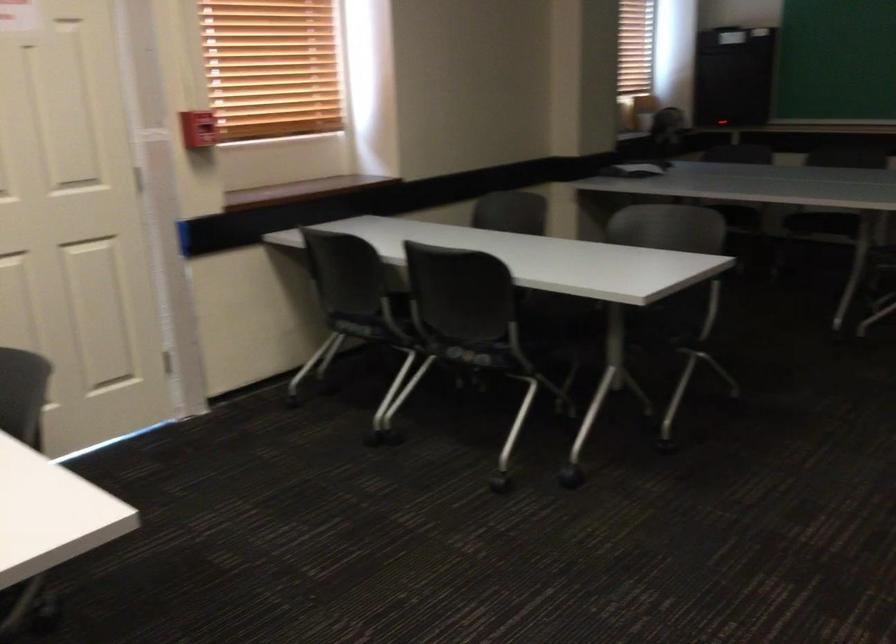
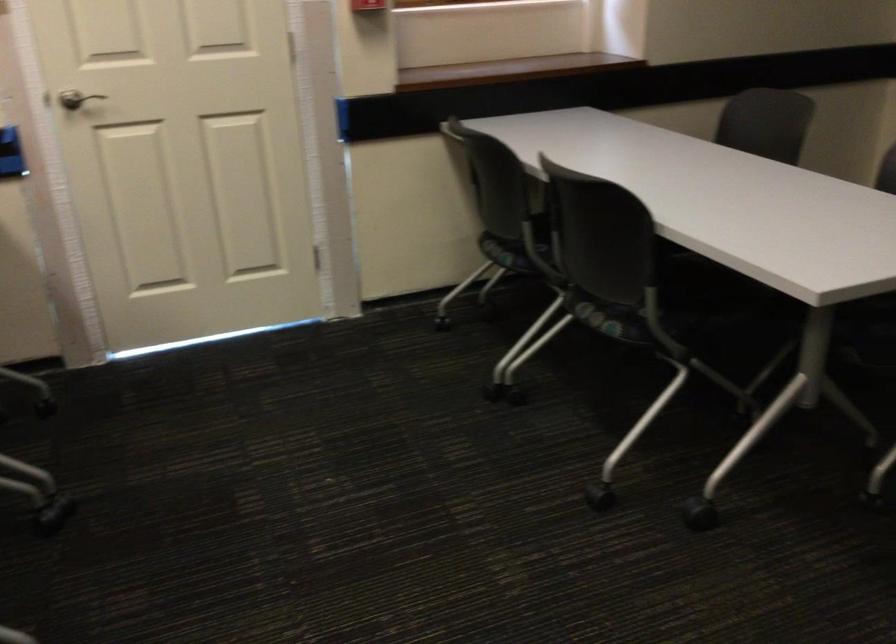
What movement of the cameraman would produce the second image?

The cameraman walked toward right, forward.